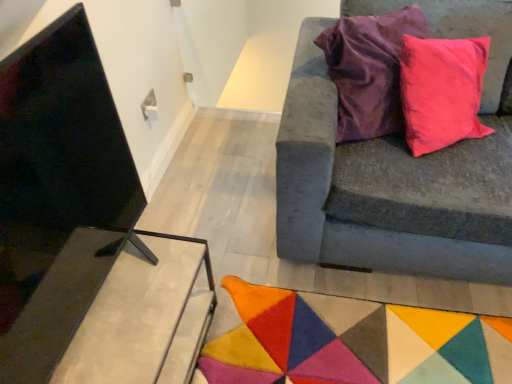
Question: Does metallic concrete table at lower left have a smaller size compared to velvet gray couch at right?

Choices:
 (A) no
 (B) yes

Answer: (B)

Question: Does metallic concrete table at lower left lie behind velvet gray couch at right?

Choices:
 (A) yes
 (B) no

Answer: (A)

Question: Is metallic concrete table at lower left closer to the viewer compared to velvet gray couch at right?

Choices:
 (A) no
 (B) yes

Answer: (A)

Question: Can you confirm if metallic concrete table at lower left is thinner than velvet gray couch at right?

Choices:
 (A) yes
 (B) no

Answer: (A)

Question: From a real-world perspective, is metallic concrete table at lower left on top of velvet gray couch at right?

Choices:
 (A) yes
 (B) no

Answer: (B)

Question: Considering the relative sizes of metallic concrete table at lower left and velvet gray couch at right in the image provided, is metallic concrete table at lower left wider than velvet gray couch at right?

Choices:
 (A) no
 (B) yes

Answer: (A)

Question: Does velvet gray couch at right have a greater width compared to metallic concrete table at lower left?

Choices:
 (A) yes
 (B) no

Answer: (A)

Question: Is velvet gray couch at right directly adjacent to metallic concrete table at lower left?

Choices:
 (A) yes
 (B) no

Answer: (B)

Question: Is velvet gray couch at right taller than metallic concrete table at lower left?

Choices:
 (A) no
 (B) yes

Answer: (B)

Question: Is metallic concrete table at lower left inside velvet gray couch at right?

Choices:
 (A) yes
 (B) no

Answer: (B)

Question: Is velvet gray couch at right thinner than metallic concrete table at lower left?

Choices:
 (A) yes
 (B) no

Answer: (B)

Question: Is velvet gray couch at right bigger than metallic concrete table at lower left?

Choices:
 (A) no
 (B) yes

Answer: (B)

Question: Is velvet gray couch at right not close to multicolored felt mat at lower center?

Choices:
 (A) yes
 (B) no

Answer: (B)